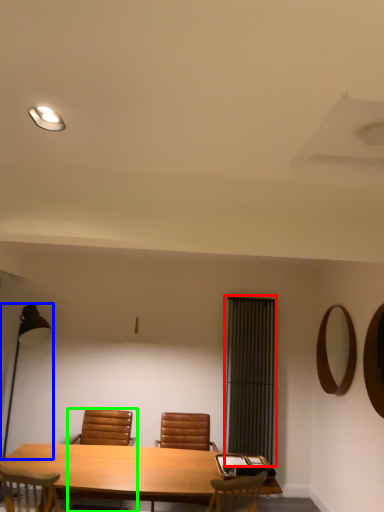
Question: Estimate the real-world distances between objects in this image. Which object is closer to curtain (highlighted by a red box), table lamp (highlighted by a blue box) or chair (highlighted by a green box)?

Choices:
 (A) table lamp
 (B) chair

Answer: (B)